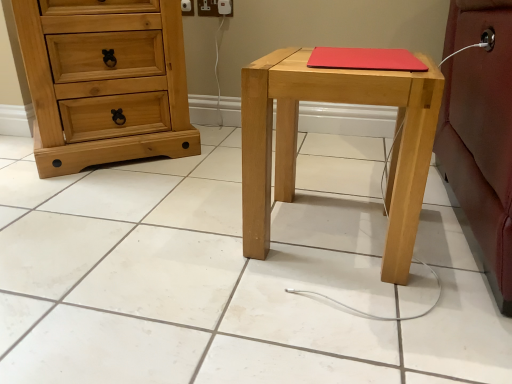
The height and width of the screenshot is (384, 512). In order to click on vacant area located to the right-hand side of natural wood stool at center in this screenshot , I will do coord(444,241).